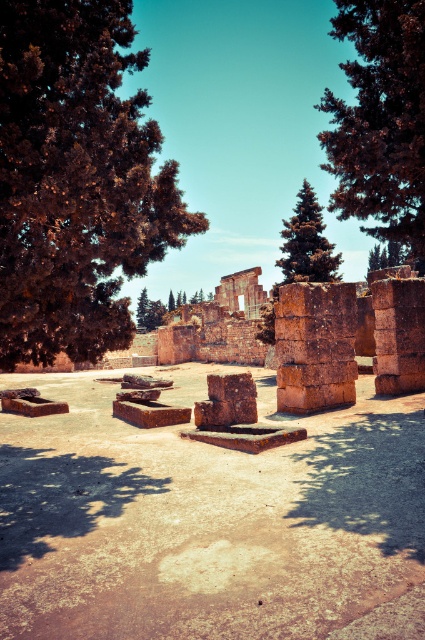
Is the position of brown textured tree at left more distant than that of dark green coniferous tree at center?

No, it is not.

Is brown textured tree at left below dark green coniferous tree at center?

Correct, brown textured tree at left is located below dark green coniferous tree at center.

Is point (138, 96) more distant than point (305, 188)?

No.

Where is `brown textured tree at left`? The image size is (425, 640). brown textured tree at left is located at coordinates (76, 180).

Image resolution: width=425 pixels, height=640 pixels. Describe the element at coordinates (380, 120) in the screenshot. I see `dark green textured tree at upper right` at that location.

Is dark green textured tree at upper right thinner than dark green coniferous tree at center?

Incorrect, dark green textured tree at upper right's width is not less than dark green coniferous tree at center's.

Where is `dark green textured tree at upper right`? The image size is (425, 640). dark green textured tree at upper right is located at coordinates (380, 120).

Does brown textured tree at left appear on the right side of dark green textured tree at upper right?

No, brown textured tree at left is not to the right of dark green textured tree at upper right.

Which is in front, point (121, 259) or point (371, 188)?

Point (121, 259) is more forward.

Is point (73, 157) closer to camera compared to point (388, 51)?

Yes, it is.

Where is `brown textured tree at left`? brown textured tree at left is located at coordinates pos(76,180).